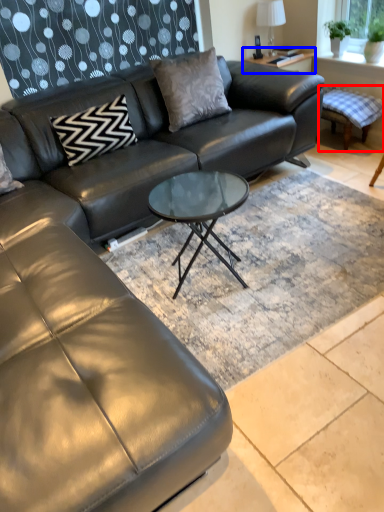
Question: Which object appears farthest to the camera in this image, swivel chair (highlighted by a red box) or side table (highlighted by a blue box)?

Choices:
 (A) swivel chair
 (B) side table

Answer: (B)